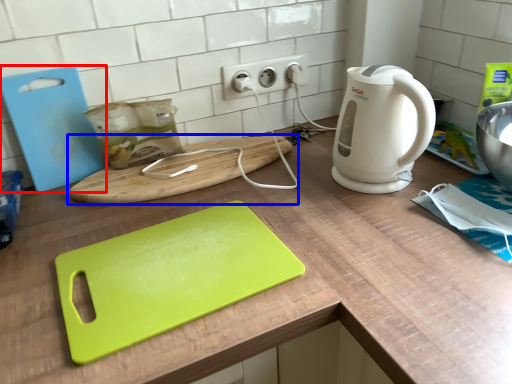
Question: Among these objects, which one is nearest to the camera, cutting board (highlighted by a red box) or cutting board (highlighted by a blue box)?

Choices:
 (A) cutting board
 (B) cutting board

Answer: (A)